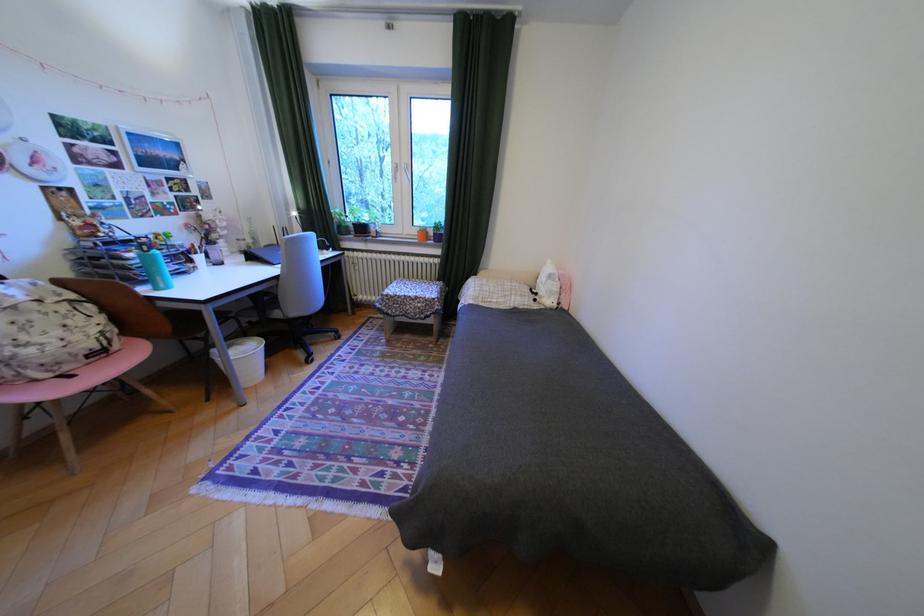
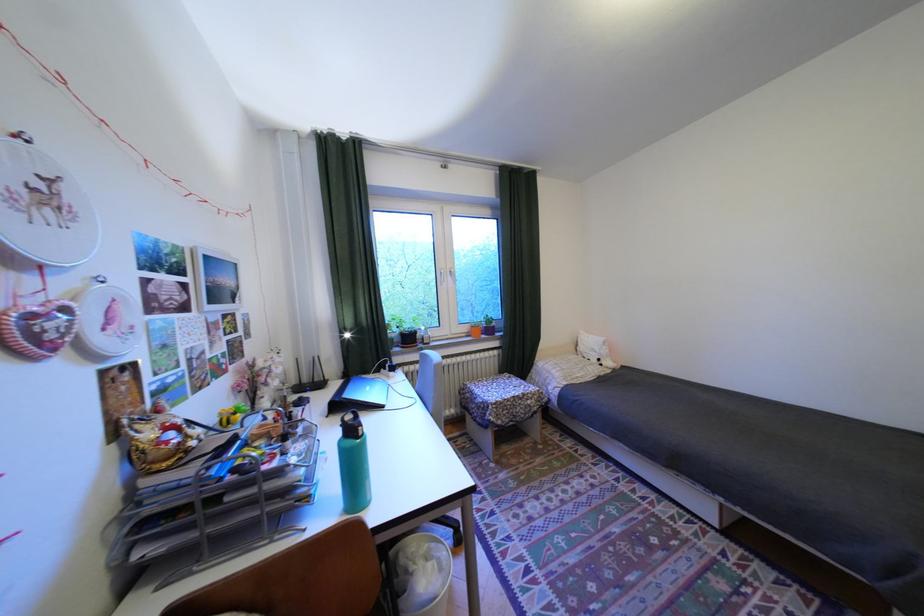
The point at (310, 209) is marked in the first image. Where is the corresponding point in the second image?

(354, 330)